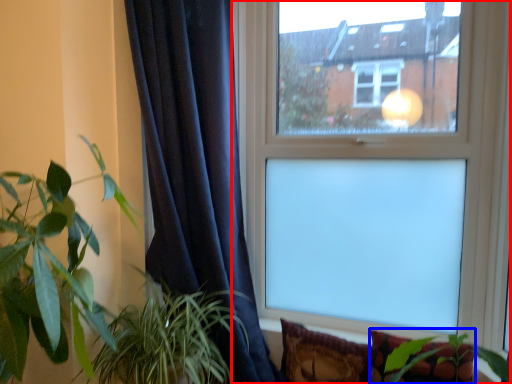
Question: Which object appears farthest to the camera in this image, window (highlighted by a red box) or pillow (highlighted by a blue box)?

Choices:
 (A) window
 (B) pillow

Answer: (A)